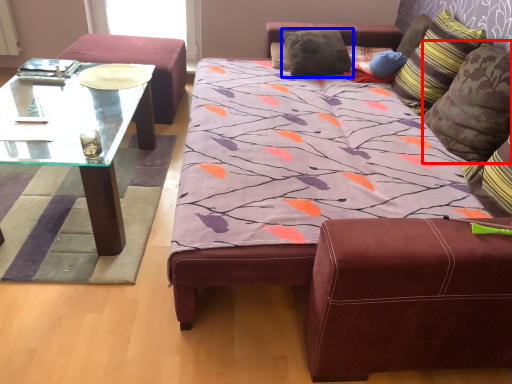
Question: Which of the following is the farthest to the observer, pillow (highlighted by a red box) or pillow (highlighted by a blue box)?

Choices:
 (A) pillow
 (B) pillow

Answer: (B)